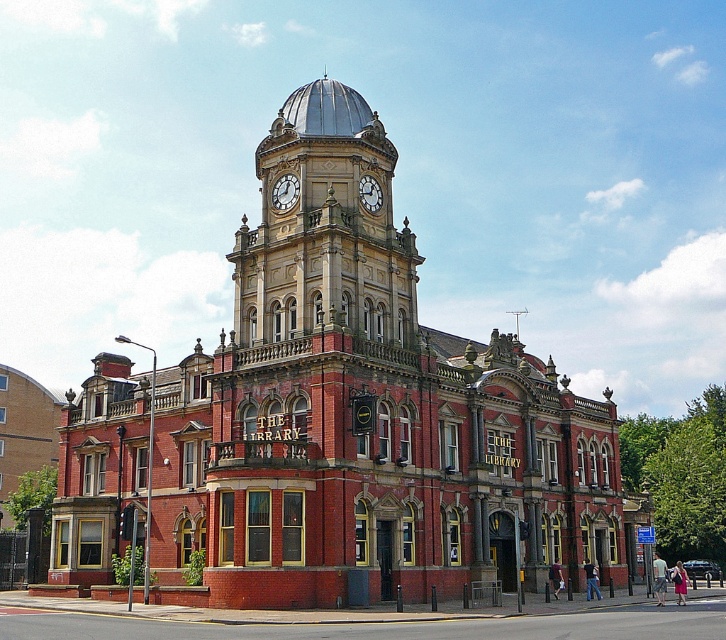
Between gold metallic clock at upper center and white painted metal clock at upper center, which one is positioned lower?

white painted metal clock at upper center is below.

Does gold metallic clock at upper center have a lesser height compared to white painted metal clock at upper center?

Indeed, gold metallic clock at upper center has a lesser height compared to white painted metal clock at upper center.

Identify the location of gold metallic clock at upper center. Image resolution: width=726 pixels, height=640 pixels. (285, 192).

Can you confirm if polished brass clock tower at upper center is positioned below gold metallic clock at upper center?

Correct, polished brass clock tower at upper center is located below gold metallic clock at upper center.

Can you confirm if polished brass clock tower at upper center is positioned to the right of gold metallic clock at upper center?

Correct, you'll find polished brass clock tower at upper center to the right of gold metallic clock at upper center.

Who is more forward, (261, 253) or (280, 182)?

Point (261, 253)

The width and height of the screenshot is (726, 640). Identify the location of polished brass clock tower at upper center. (325, 228).

Can you confirm if polished brass clock tower at upper center is smaller than white painted metal clock at upper center?

Incorrect, polished brass clock tower at upper center is not smaller in size than white painted metal clock at upper center.

You are a GUI agent. You are given a task and a screenshot of the screen. Output one action in this format:
    pyautogui.click(x=<x>, y=<y>)
    Task: Click on the polished brass clock tower at upper center
    This screenshot has width=726, height=640.
    Given the screenshot: What is the action you would take?
    pyautogui.click(x=325, y=228)